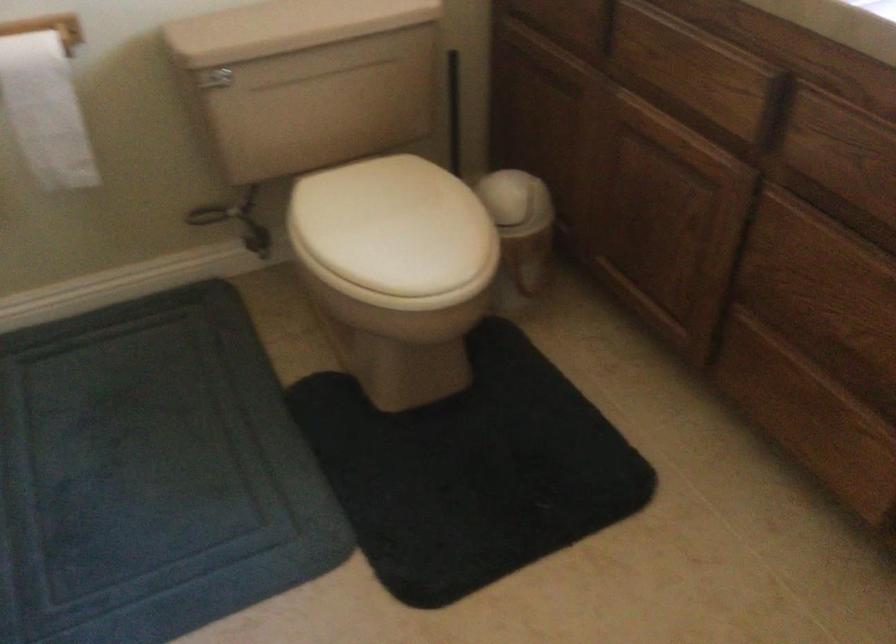
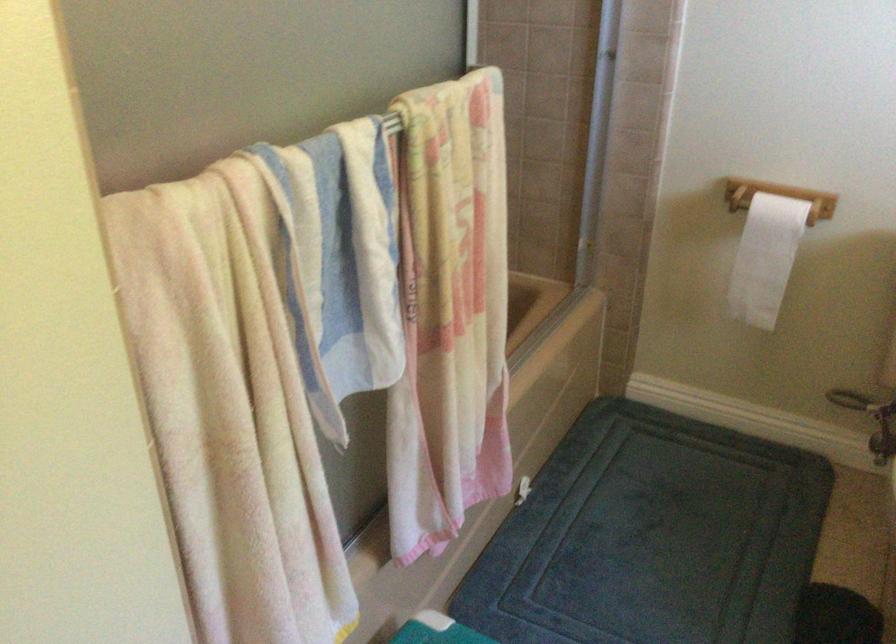
The point at (236, 232) is marked in the first image. Where is the corresponding point in the second image?

(871, 420)